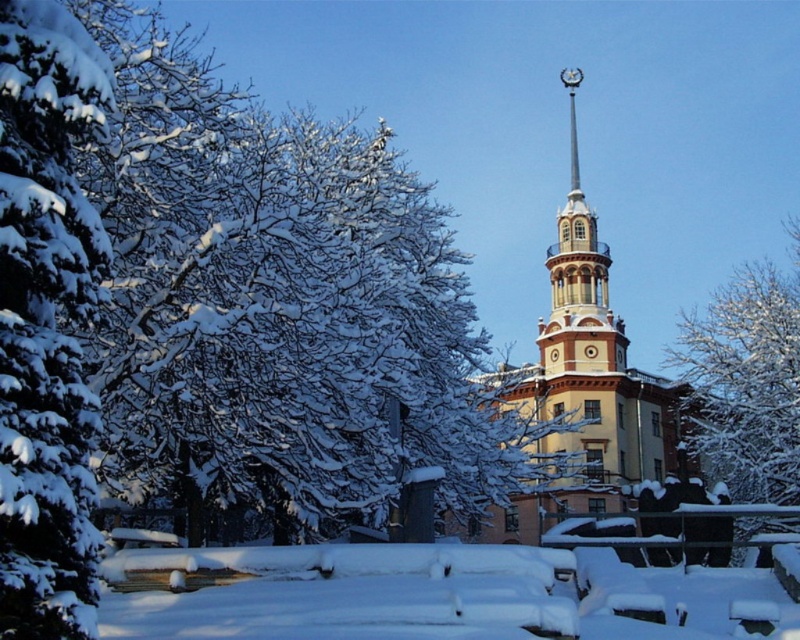
Question: Estimate the real-world distances between objects in this image. Which object is closer to the white fluffy snow at left?

Choices:
 (A) white snow-covered tree at center
 (B) yellow painted wood tower at center

Answer: (B)

Question: Does white fluffy snow at left have a greater width compared to white snow-covered tree at center?

Choices:
 (A) no
 (B) yes

Answer: (A)

Question: Which object is the farthest from the yellow painted wood tower at center?

Choices:
 (A) white snow-covered tree at center
 (B) white fluffy snow at left

Answer: (B)

Question: Can you confirm if yellow painted wood tower at center is wider than white snow-covered tree at center?

Choices:
 (A) yes
 (B) no

Answer: (A)

Question: From the image, what is the correct spatial relationship of white fluffy snow at left in relation to white snow-covered tree at center?

Choices:
 (A) left
 (B) right

Answer: (A)

Question: Which point is closer to the camera?

Choices:
 (A) (60, 520)
 (B) (720, 300)
 (C) (580, 412)

Answer: (A)